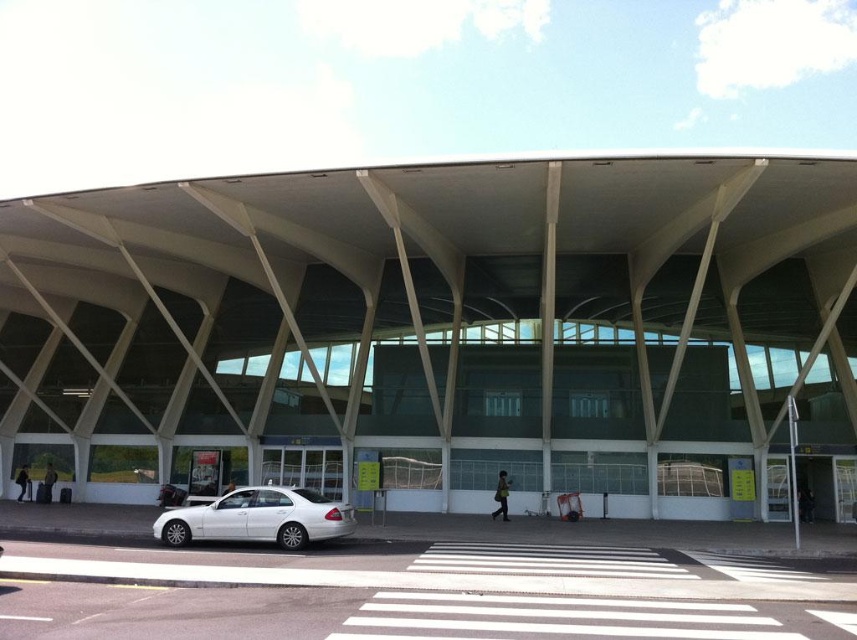
Question: Which point is farther to the camera?

Choices:
 (A) matte white building at center
 (B) white glossy sedan at center

Answer: (A)

Question: Can you confirm if matte white building at center is smaller than white glossy sedan at center?

Choices:
 (A) yes
 (B) no

Answer: (B)

Question: Which of the following is the farthest from the observer?

Choices:
 (A) (238, 500)
 (B) (666, 256)

Answer: (B)

Question: Is matte white building at center wider than white glossy sedan at center?

Choices:
 (A) no
 (B) yes

Answer: (B)

Question: Which of the following is the farthest from the observer?

Choices:
 (A) tap(550, 472)
 (B) tap(196, 531)

Answer: (A)

Question: Considering the relative positions of matte white building at center and white glossy sedan at center in the image provided, where is matte white building at center located with respect to white glossy sedan at center?

Choices:
 (A) right
 (B) left

Answer: (A)